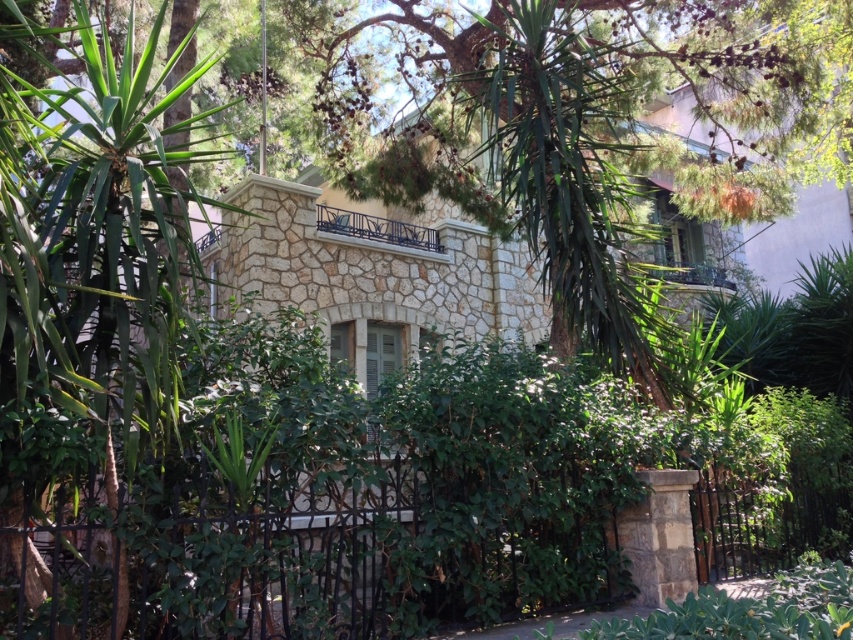
You are standing in front of the stone house and want to take a photo. There are two points marked in the image, point 1 at coordinates (740, 140) and point 2 at coordinates (392, 570). Which point will appear closer to the camera in your photo?

Point 2 at coordinates (392, 570) will appear closer to the camera because it is physically closer to the camera than point 1 at coordinates (740, 140).